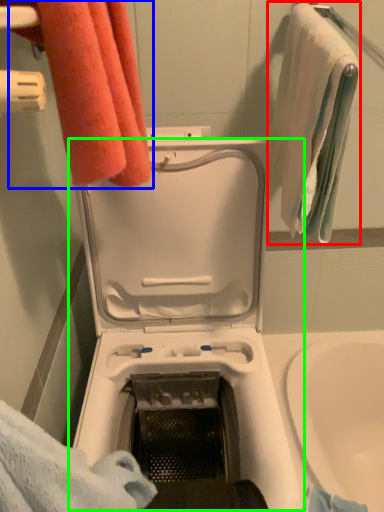
Question: Considering the real-world distances, which object is farthest from towel (highlighted by a red box)? towel (highlighted by a blue box) or washing machine (highlighted by a green box)?

Choices:
 (A) towel
 (B) washing machine

Answer: (A)